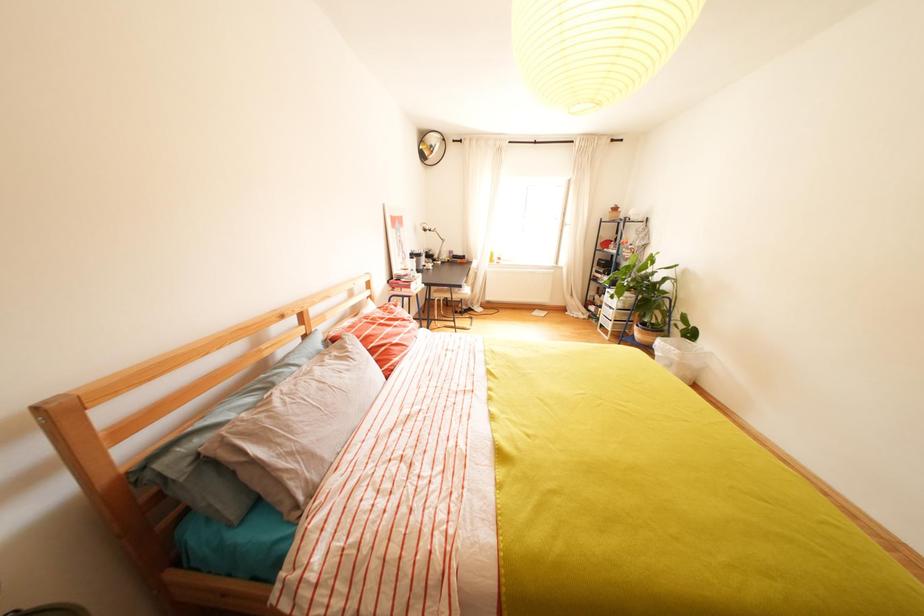
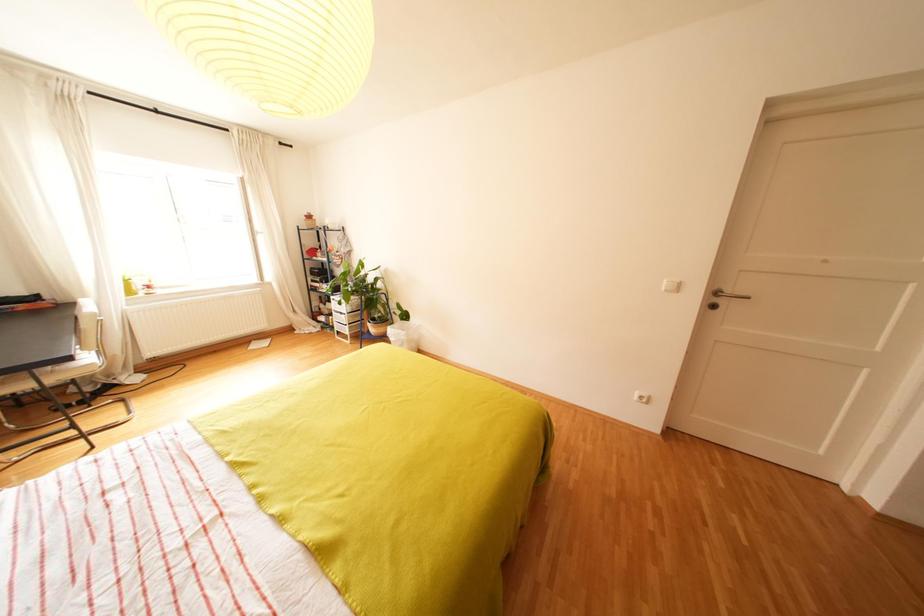
Question: The images are taken continuously from a first-person perspective. In which direction is your viewpoint rotating?

Choices:
 (A) Left
 (B) Right
 (C) Up
 (D) Down

Answer: (B)